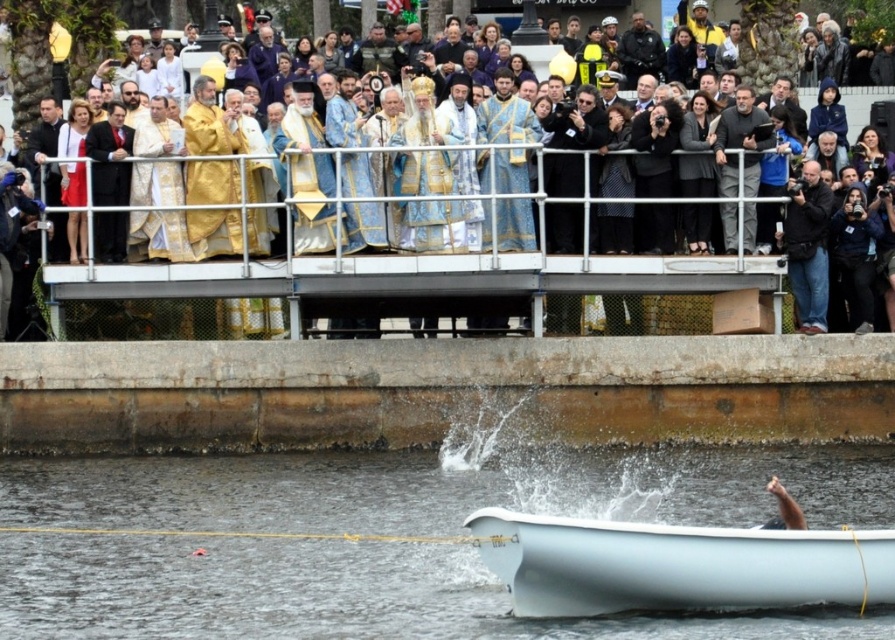
Who is positioned more to the right, black matte jacket at upper right or black uniformed officer at upper center?

Positioned to the right is black matte jacket at upper right.

Does black matte jacket at upper right appear over black uniformed officer at upper center?

No.

Where is `black matte jacket at upper right`? This screenshot has width=895, height=640. black matte jacket at upper right is located at coordinates (740, 145).

Is white matte boat at lower center above black leather jacket at right?

No.

I want to click on white matte boat at lower center, so click(x=678, y=564).

Describe the element at coordinates (678, 564) in the screenshot. The height and width of the screenshot is (640, 895). I see `white matte boat at lower center` at that location.

Image resolution: width=895 pixels, height=640 pixels. Find the location of `white matte boat at lower center`. white matte boat at lower center is located at coordinates (678, 564).

Between point (815, 256) and point (783, 516), which one is positioned behind?

The point (815, 256) is more distant.

The width and height of the screenshot is (895, 640). Identify the location of black leather jacket at right. (807, 246).